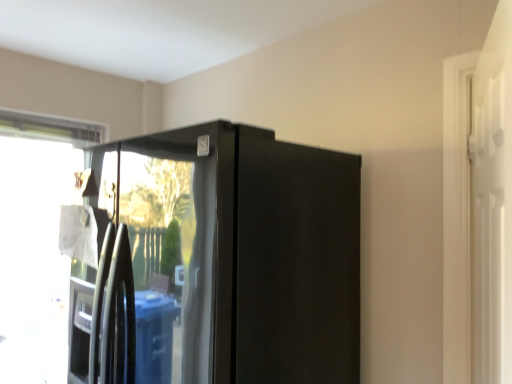
Question: Is transparent glass window at left taller or shorter than glossy black refrigerator at center?

Choices:
 (A) tall
 (B) short

Answer: (A)

Question: Considering the positions of transparent glass window at left and glossy black refrigerator at center in the image, is transparent glass window at left bigger or smaller than glossy black refrigerator at center?

Choices:
 (A) big
 (B) small

Answer: (B)

Question: Based on their relative distances, which object is farther from the glossy black refrigerator at center?

Choices:
 (A) transparent glass window at left
 (B) white glossy screen door at right

Answer: (A)

Question: Estimate the real-world distances between objects in this image. Which object is farther from the glossy black refrigerator at center?

Choices:
 (A) transparent glass window at left
 (B) white glossy screen door at right

Answer: (A)